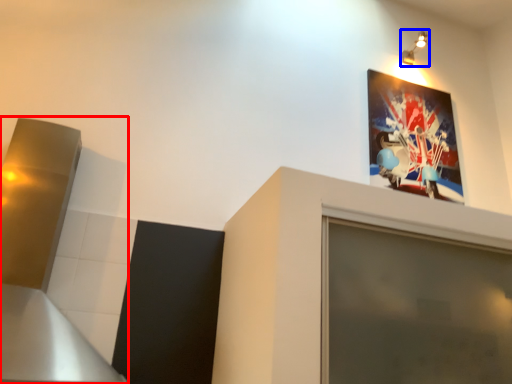
Question: Which object appears farthest to the camera in this image, exhaust hood (highlighted by a red box) or light fixture (highlighted by a blue box)?

Choices:
 (A) exhaust hood
 (B) light fixture

Answer: (B)